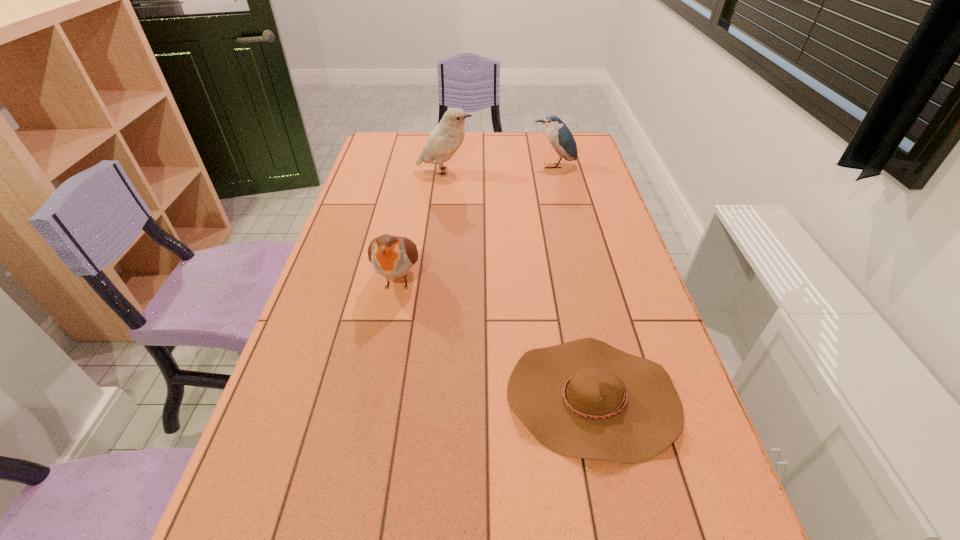
This screenshot has height=540, width=960. In order to click on the tallest bird in this screenshot , I will do `click(443, 142)`.

Find the location of a particular element. the rightmost bird is located at coordinates (558, 134).

Identify the location of the third farthest object. This screenshot has height=540, width=960. (391, 256).

Locate an element on the screen. The image size is (960, 540). cowboy hat is located at coordinates (585, 399).

You are a GUI agent. You are given a task and a screenshot of the screen. Output one action in this format:
    pyautogui.click(x=<x>, y=<y>)
    Task: Click on the shortest object
    Image resolution: width=960 pixels, height=540 pixels.
    Given the screenshot: What is the action you would take?
    pyautogui.click(x=585, y=399)

This screenshot has height=540, width=960. Identify the location of vacant region located at the beak of the tallest bird. (556, 172).

Where is `free space located 0.230m at the tip of the rightmost bird's beak`? free space located 0.230m at the tip of the rightmost bird's beak is located at coordinates [563, 206].

You are a GUI agent. You are given a task and a screenshot of the screen. Output one action in this format:
    pyautogui.click(x=<x>, y=<y>)
    Task: Click on the vacant region located at the face of the second nearest object
    
    Given the screenshot: What is the action you would take?
    pyautogui.click(x=380, y=372)

You are a GUI agent. You are given a task and a screenshot of the screen. Output one action in this format:
    pyautogui.click(x=<x>, y=<y>)
    Task: Click on the vacant space situated on the back of the shortest object
    The height and width of the screenshot is (540, 960).
    Given the screenshot: What is the action you would take?
    pyautogui.click(x=561, y=245)

The height and width of the screenshot is (540, 960). In order to click on object at the left edge in this screenshot , I will do `click(391, 256)`.